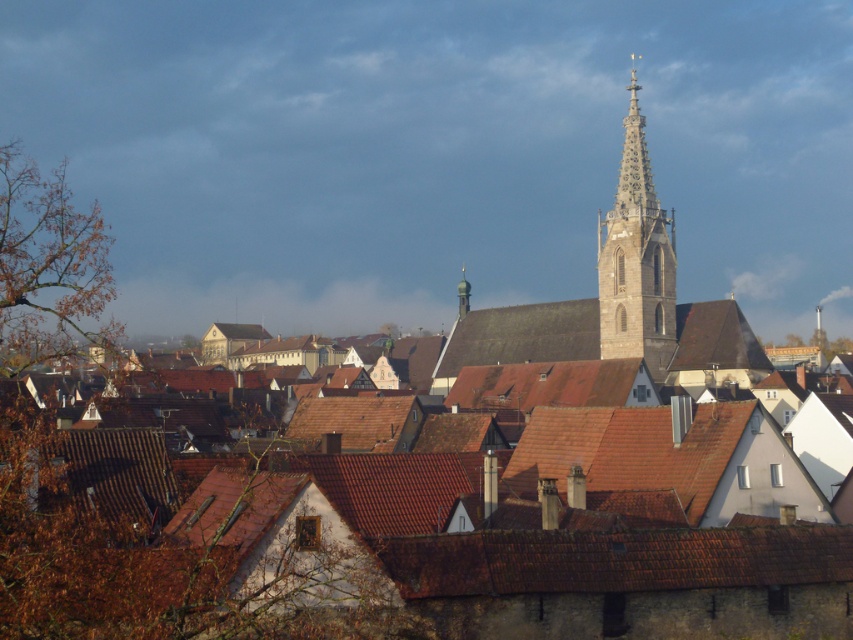
Question: Estimate the real-world distances between objects in this image. Which object is farther from the stone steeple at center?

Choices:
 (A) brown tile roof at lower center
 (B) green metallic spire at upper center

Answer: (A)

Question: Where is brown tile roof at lower center located in relation to green metallic spire at upper center in the image?

Choices:
 (A) left
 (B) right

Answer: (B)

Question: Is brown tile roof at lower center to the left of stone steeple at center from the viewer's perspective?

Choices:
 (A) yes
 (B) no

Answer: (A)

Question: Which of these objects is positioned farthest from the brown tile roof at lower center?

Choices:
 (A) stone steeple at center
 (B) green metallic spire at upper center

Answer: (B)

Question: Does brown tile roof at lower center appear over green metallic spire at upper center?

Choices:
 (A) yes
 (B) no

Answer: (B)

Question: Which point is farther to the camera?

Choices:
 (A) stone steeple at center
 (B) green metallic spire at upper center

Answer: (B)